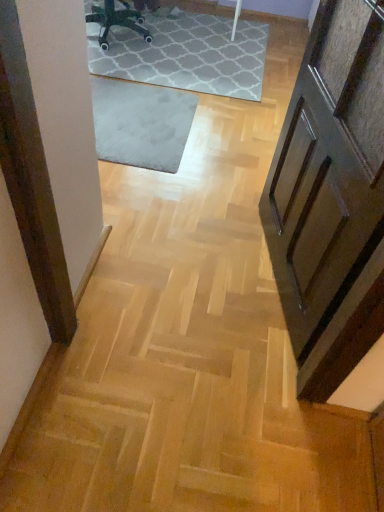
Where is `free spot in front of black plastic chair at upper center`? Image resolution: width=384 pixels, height=512 pixels. free spot in front of black plastic chair at upper center is located at coordinates (123, 61).